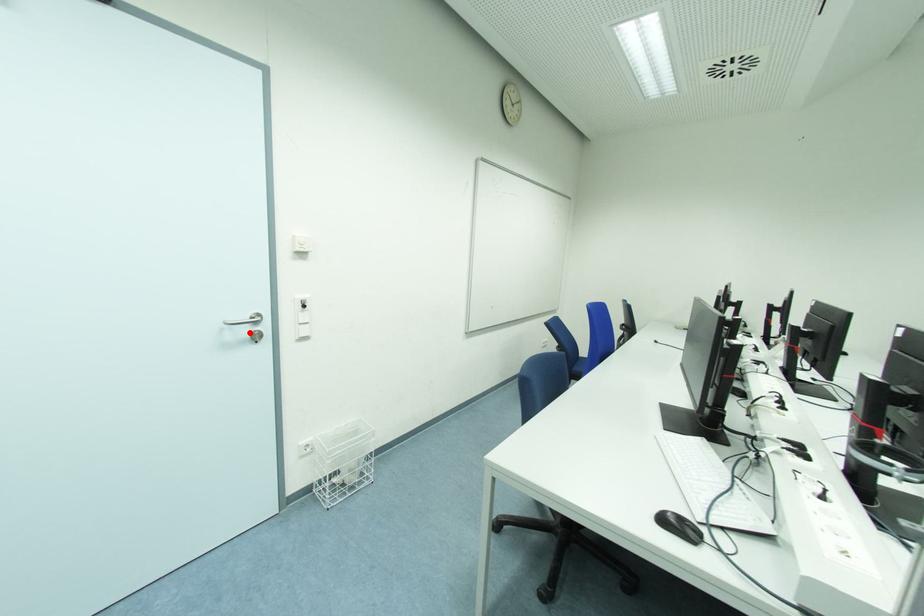
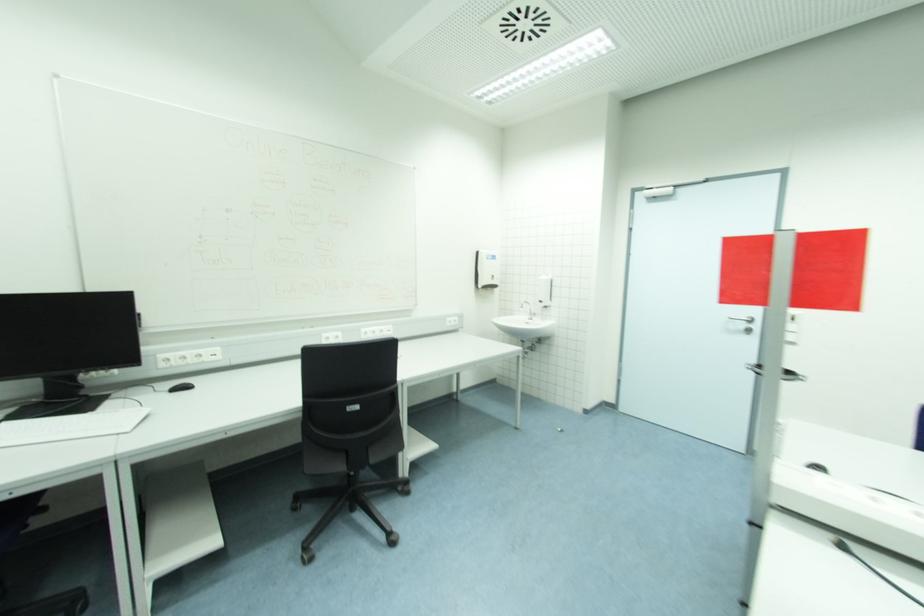
Locate, in the second image, the point that corresponds to the highlighted location in the first image.

(746, 326)